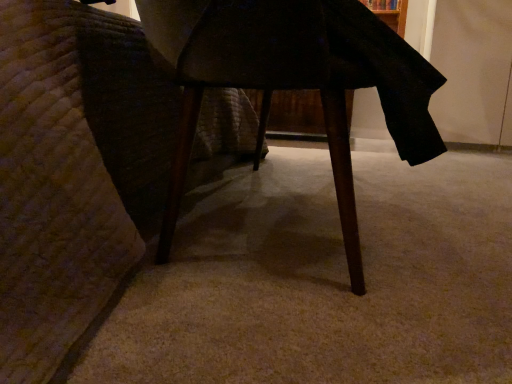
Question: From the image's perspective, is wooden chair leg at lower left on top of wooden table at center?

Choices:
 (A) yes
 (B) no

Answer: (A)

Question: Considering the relative sizes of wooden chair leg at lower left and wooden table at center in the image provided, is wooden chair leg at lower left shorter than wooden table at center?

Choices:
 (A) no
 (B) yes

Answer: (A)

Question: Is wooden chair leg at lower left facing towards wooden table at center?

Choices:
 (A) no
 (B) yes

Answer: (B)

Question: Does wooden chair leg at lower left have a greater height compared to wooden table at center?

Choices:
 (A) no
 (B) yes

Answer: (B)

Question: Does wooden chair leg at lower left have a lesser width compared to wooden table at center?

Choices:
 (A) yes
 (B) no

Answer: (B)

Question: Is the surface of wooden chair leg at lower left in direct contact with wooden table at center?

Choices:
 (A) yes
 (B) no

Answer: (B)

Question: Is wooden table at center shorter than wooden chair leg at lower left?

Choices:
 (A) yes
 (B) no

Answer: (A)

Question: Can wooden chair leg at lower left be found inside wooden table at center?

Choices:
 (A) yes
 (B) no

Answer: (B)

Question: From a real-world perspective, is wooden table at center on top of wooden chair leg at lower left?

Choices:
 (A) no
 (B) yes

Answer: (A)

Question: Is wooden table at center closer to camera compared to wooden chair leg at lower left?

Choices:
 (A) no
 (B) yes

Answer: (A)

Question: Is wooden table at center not inside wooden chair leg at lower left?

Choices:
 (A) yes
 (B) no

Answer: (B)

Question: Would you consider wooden table at center to be distant from wooden chair leg at lower left?

Choices:
 (A) no
 (B) yes

Answer: (A)

Question: Considering the positions of wooden table at center and wooden chair leg at lower left in the image, is wooden table at center bigger or smaller than wooden chair leg at lower left?

Choices:
 (A) big
 (B) small

Answer: (B)